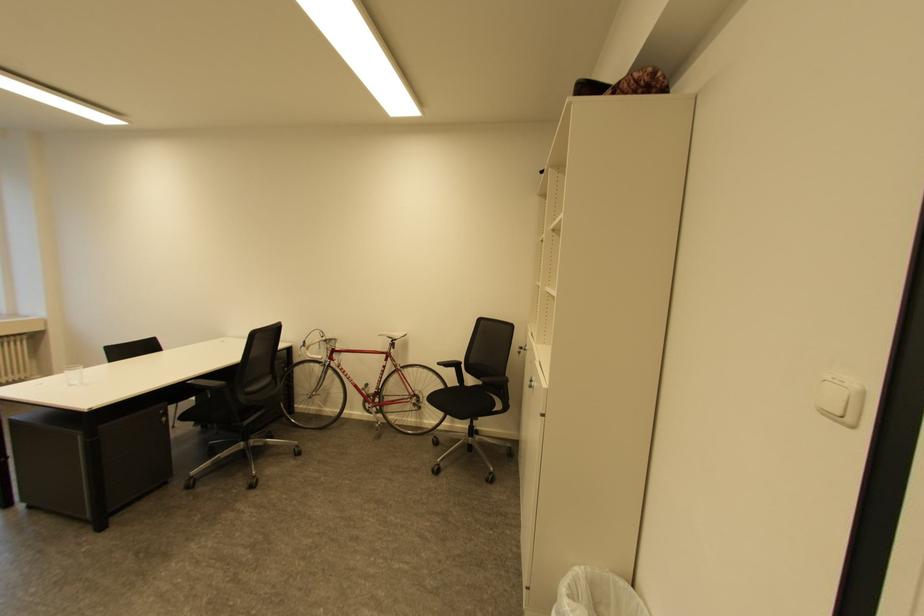
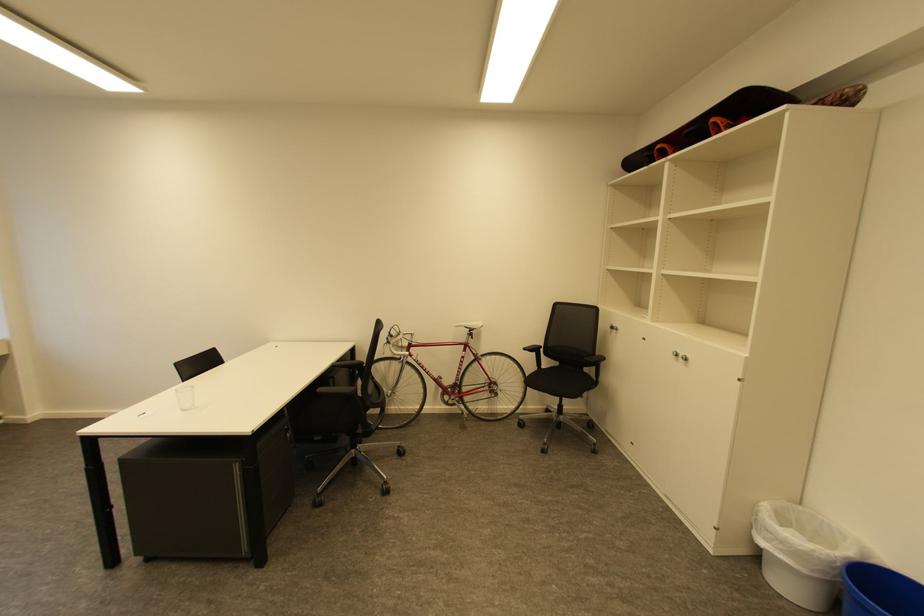
In the second image, find the point that corresponds to (393,361) in the first image.

(471, 351)